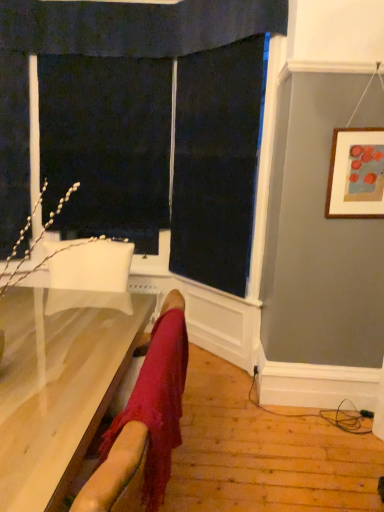
Image resolution: width=384 pixels, height=512 pixels. Find the location of `blank space situated above wooden framed artwork at upper right (from a real-world perspective)`. blank space situated above wooden framed artwork at upper right (from a real-world perspective) is located at coordinates (363, 129).